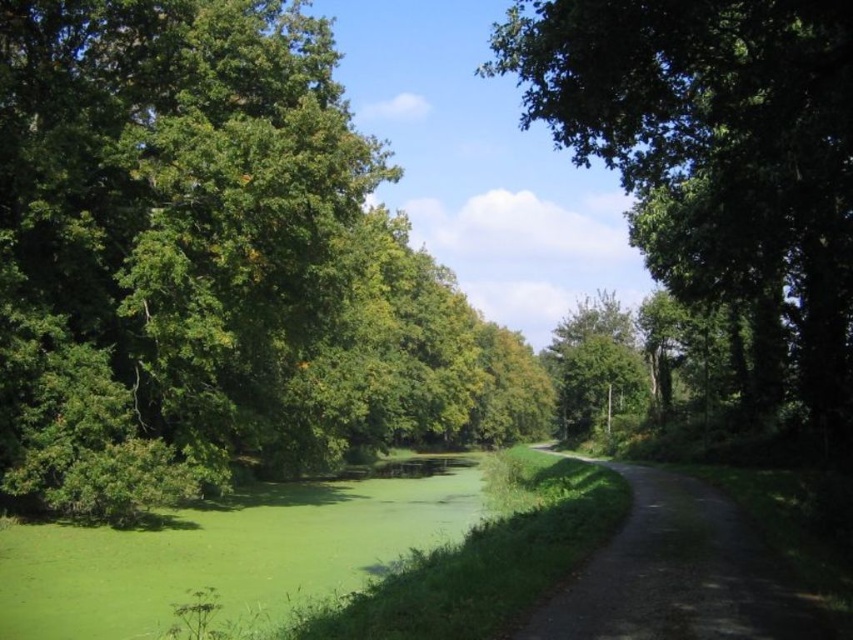
You are standing at the point marked by the coordinates point [213,266] in the image. Looking around, you see a green leafy tree at left. Which direction should you face to see the green leafy tree at left?

You should face towards the left direction to see the green leafy tree at left.

You are a hiker walking along the narrow dirt path in the image. You notice two green leafy trees in the scene. Which tree, the green leafy tree at left or the green leafy tree at upper right, would appear closer to you as you walk along the path?

The green leafy tree at left is closer to you than the green leafy tree at upper right because it is positioned further to the viewer in the image.